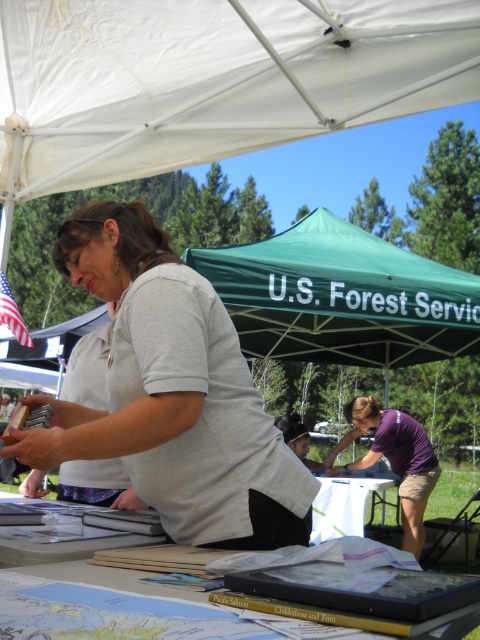
Question: Which object appears farthest from the camera in this image?

Choices:
 (A) white paper at center
 (B) white fabric canopy at upper center
 (C) purple fabric at center

Answer: (C)

Question: Based on their relative distances, which object is farther from the gray matte shirt at center?

Choices:
 (A) purple fabric at center
 (B) white paper at center
 (C) green fabric canopy at center

Answer: (A)

Question: Does white fabric canopy at upper center appear on the left side of white paper at center?

Choices:
 (A) no
 (B) yes

Answer: (B)

Question: Which is farther from the white fabric canopy at upper center?

Choices:
 (A) purple fabric at center
 (B) gray matte shirt at center
 (C) green fabric canopy at center

Answer: (A)

Question: From the image, what is the correct spatial relationship of white fabric canopy at upper center in relation to purple fabric at center?

Choices:
 (A) left
 (B) right

Answer: (A)

Question: Is purple fabric at center below white paper at center?

Choices:
 (A) no
 (B) yes

Answer: (A)